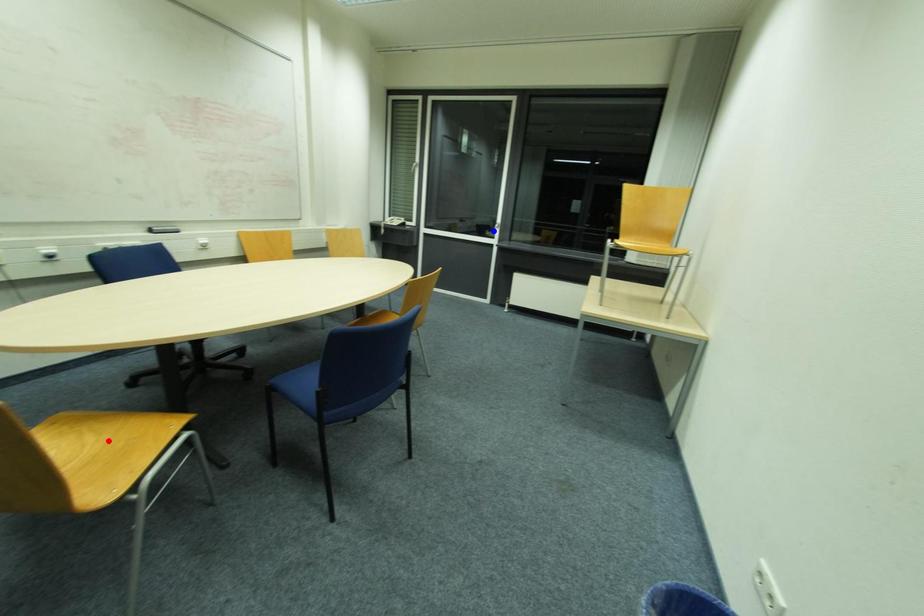
Question: Which of the two points in the image is closer to the camera?

Choices:
 (A) Blue point is closer.
 (B) Red point is closer.

Answer: (B)